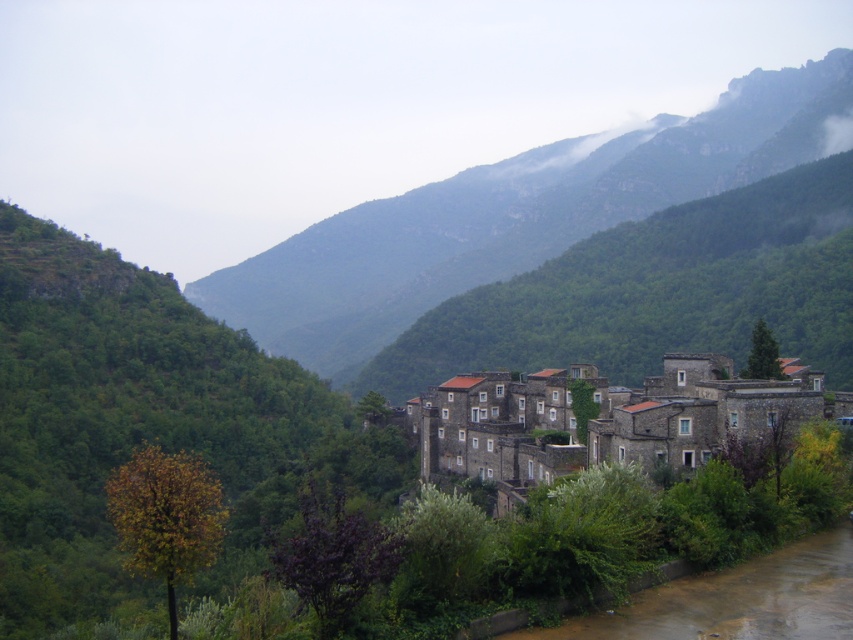
You are standing at the coordinates 0.5, 0.5 in the image. Which direction should you move to reach the stone village at center?

The stone village at center is located at coordinates (606, 419). Since you are at (426, 320), you should move northeast to reach it.

In the scene shown: You are standing at the point marked by the coordinates point (515, 216) in the image. Looking around, you see a green rocky mountain at center. What is the name of the feature you are standing on?

The point (515, 216) indicates the green rocky mountain at center, so you are standing on the green rocky mountain at center.

You are standing at the bottom right corner of the image where the dirt path is located. You want to reach the green rocky mountain at center. Which direction should you move in to get closer to the mountain?

The green rocky mountain at center is located at point 0.339 on the x axis and 0.605 on the y axis. Since you are at the bottom right corner, which is the lower right position, moving towards the center would involve moving left and slightly upward to reach the mountain.